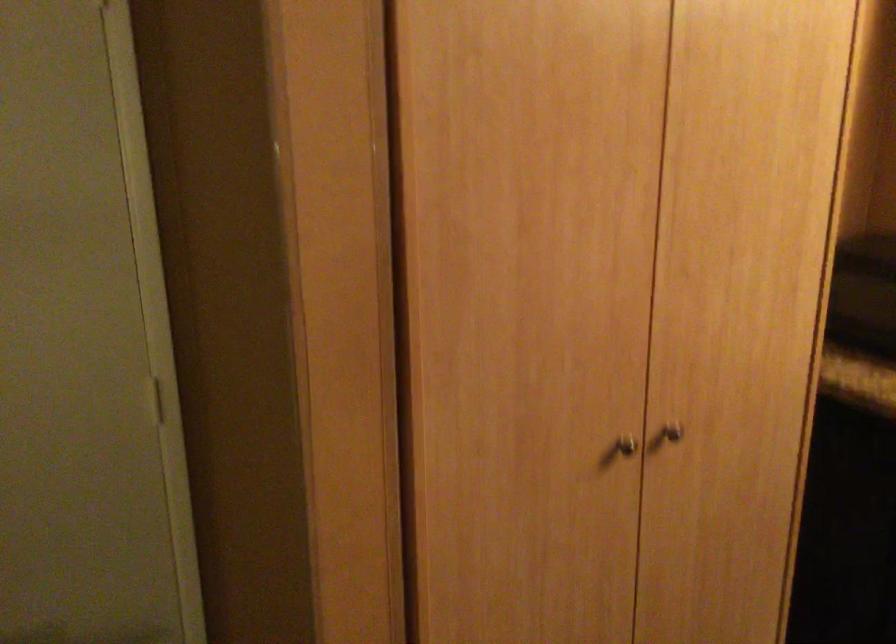
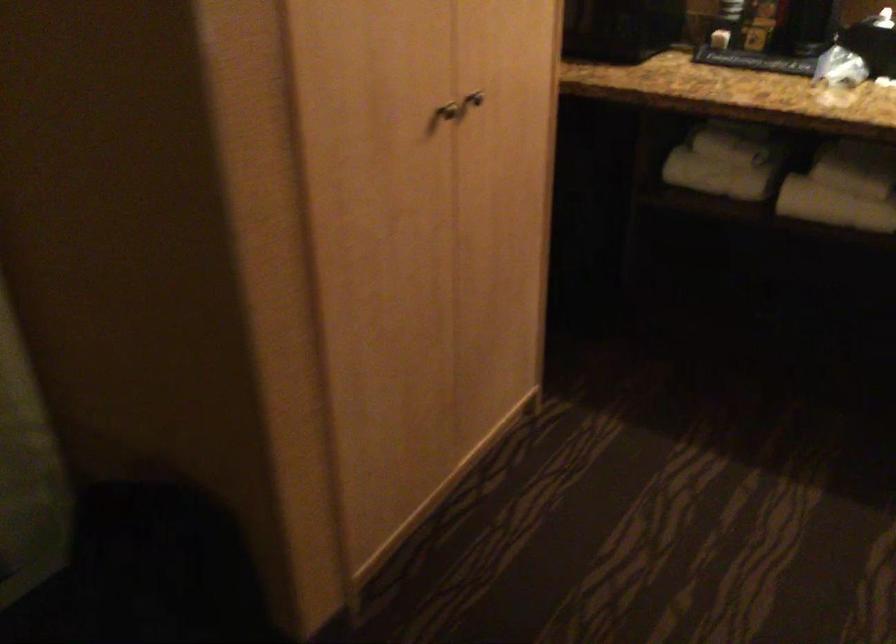
Question: What movement of the cameraman would produce the second image?

Choices:
 (A) Left
 (B) Right
 (C) Forward
 (D) Backward

Answer: (A)